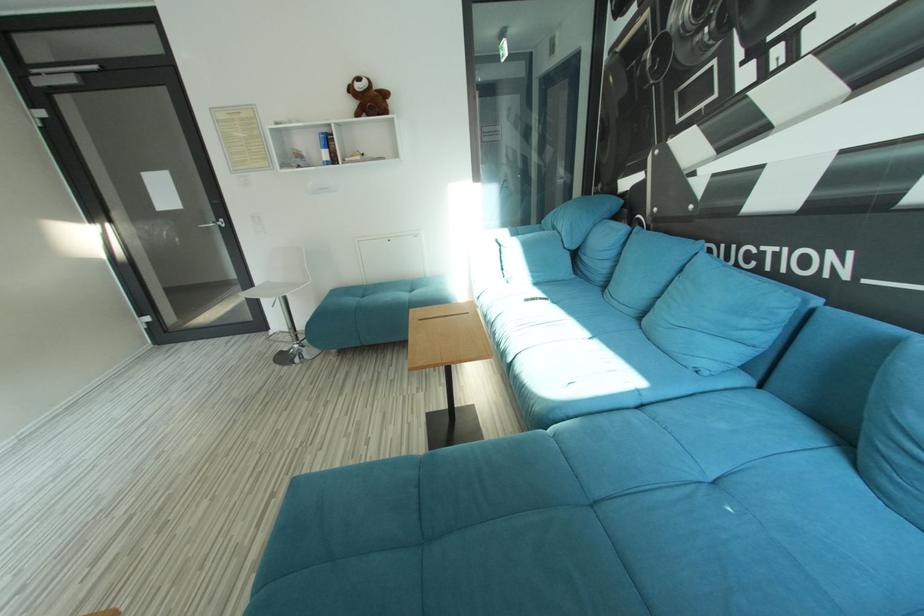
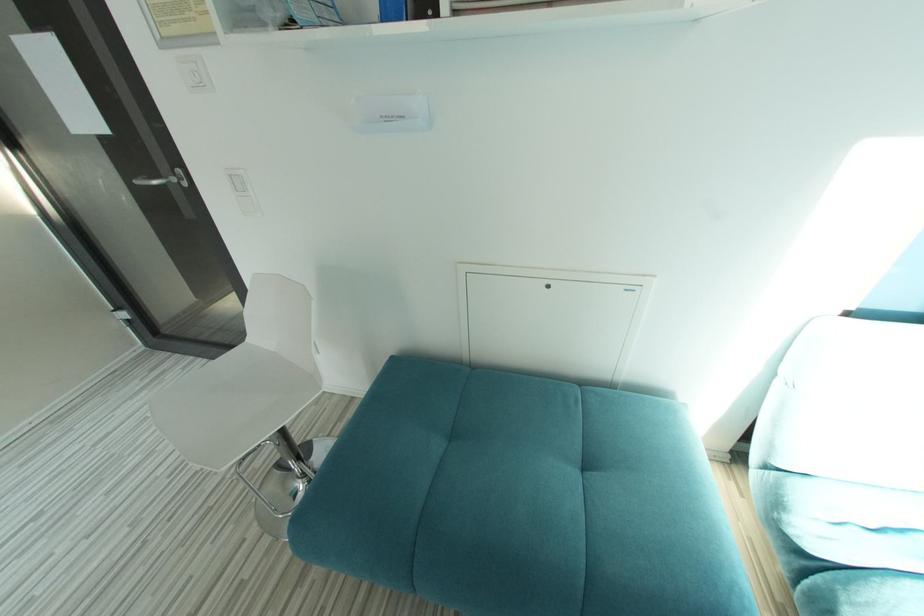
Question: The images are taken continuously from a first-person perspective. In which direction are you moving?

Choices:
 (A) Left
 (B) Right
 (C) Forward
 (D) Backward

Answer: (C)